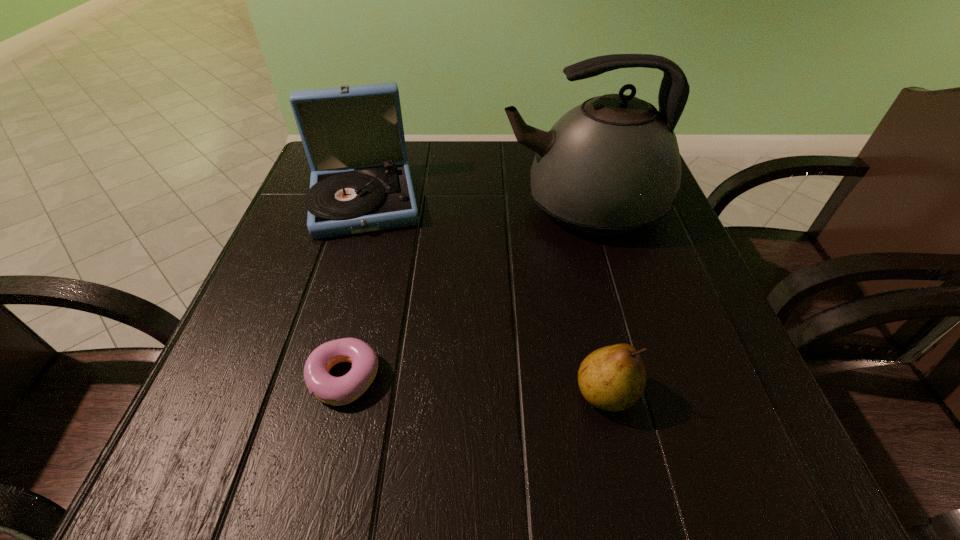
Identify the location of kettle at the far edge. (609, 166).

Find the location of a particular element. This screenshot has width=960, height=540. phonograph record at the far edge is located at coordinates (353, 136).

This screenshot has width=960, height=540. In order to click on phonograph record at the left edge in this screenshot , I will do `click(353, 136)`.

The image size is (960, 540). I want to click on doughnut at the left edge, so click(x=337, y=391).

You are a GUI agent. You are given a task and a screenshot of the screen. Output one action in this format:
    pyautogui.click(x=<x>, y=<y>)
    Task: Click on the object at the right edge
    The image size is (960, 540).
    Given the screenshot: What is the action you would take?
    pyautogui.click(x=609, y=166)

Image resolution: width=960 pixels, height=540 pixels. Identify the location of object that is at the far left corner. (353, 136).

The height and width of the screenshot is (540, 960). I want to click on object present at the far right corner, so click(x=609, y=166).

In the image, there is a desktop. Where is `vacant space at the far edge`? Image resolution: width=960 pixels, height=540 pixels. vacant space at the far edge is located at coordinates (495, 160).

In the image, there is a desktop. At what (x,y) coordinates should I click in order to perform the action: click on free region at the near edge. Please return your answer as a coordinate pair (x, y). The height and width of the screenshot is (540, 960). Looking at the image, I should click on (568, 442).

I want to click on free region at the left edge of the desktop, so pyautogui.click(x=243, y=380).